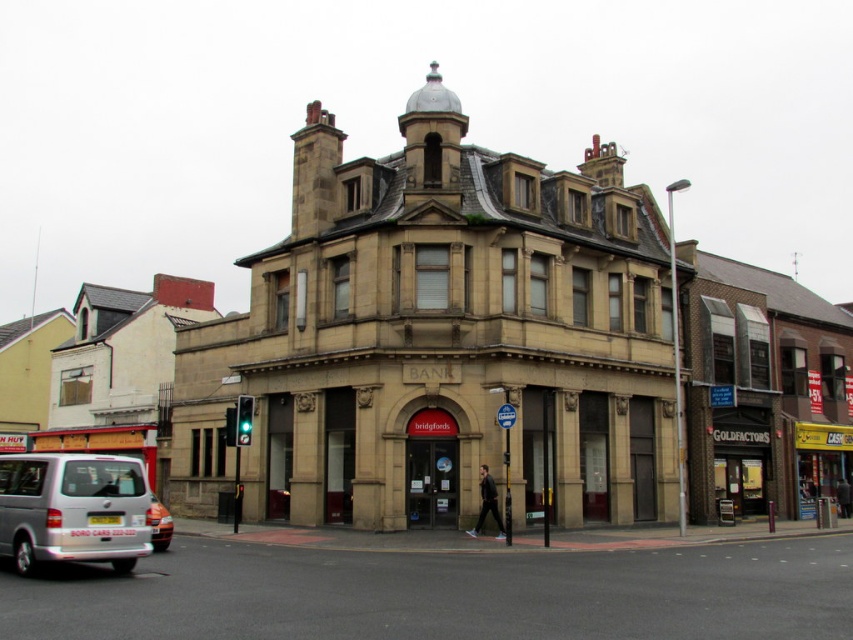
Can you confirm if silver metallic van at lower left is smaller than orange matte car at lower left?

Incorrect, silver metallic van at lower left is not smaller in size than orange matte car at lower left.

Is point (33, 540) closer to viewer compared to point (155, 508)?

Yes.

Where is `silver metallic van at lower left`? This screenshot has height=640, width=853. silver metallic van at lower left is located at coordinates (73, 509).

Is point (74, 602) in front of point (57, 524)?

Yes, point (74, 602) is in front of point (57, 524).

Is metallic silver van at lower left bigger than silver metallic van at lower left?

No.

Is point (225, 634) more distant than point (22, 493)?

No.

This screenshot has width=853, height=640. In order to click on metallic silver van at lower left in this screenshot , I will do tap(444, 593).

Does metallic silver van at lower left appear under orange matte car at lower left?

No, metallic silver van at lower left is not below orange matte car at lower left.

Between point (397, 552) and point (163, 531), which one is positioned in front?

Positioned in front is point (163, 531).

This screenshot has width=853, height=640. In order to click on metallic silver van at lower left in this screenshot , I will do `click(444, 593)`.